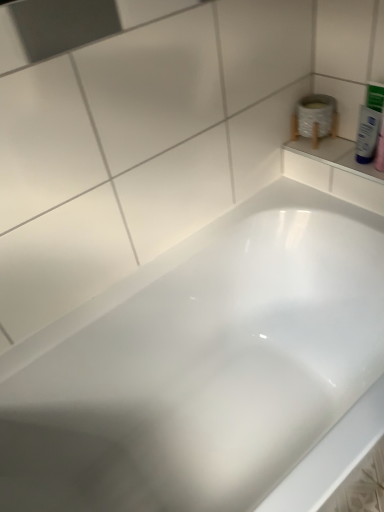
Question: Is white glossy tube at upper right facing away from white glossy bathtub at center?

Choices:
 (A) yes
 (B) no

Answer: (B)

Question: Is white glossy tube at upper right taller than white glossy bathtub at center?

Choices:
 (A) yes
 (B) no

Answer: (B)

Question: From a real-world perspective, is white glossy tube at upper right positioned under white glossy bathtub at center based on gravity?

Choices:
 (A) yes
 (B) no

Answer: (B)

Question: From a real-world perspective, is white glossy tube at upper right on top of white glossy bathtub at center?

Choices:
 (A) no
 (B) yes

Answer: (B)

Question: Can you confirm if white glossy tube at upper right is positioned to the left of white glossy bathtub at center?

Choices:
 (A) yes
 (B) no

Answer: (B)

Question: Could you tell me if white glossy tube at upper right is turned towards white glossy bathtub at center?

Choices:
 (A) yes
 (B) no

Answer: (B)

Question: Is white glossy bathtub at center at the left side of white glossy tube at upper right?

Choices:
 (A) yes
 (B) no

Answer: (A)

Question: Is white glossy bathtub at center closer to camera compared to white glossy tube at upper right?

Choices:
 (A) no
 (B) yes

Answer: (B)

Question: From a real-world perspective, is white glossy bathtub at center on top of white glossy tube at upper right?

Choices:
 (A) yes
 (B) no

Answer: (B)

Question: Is white glossy bathtub at center taller than white glossy tube at upper right?

Choices:
 (A) no
 (B) yes

Answer: (B)

Question: Could you tell me if white glossy bathtub at center is turned towards white glossy tube at upper right?

Choices:
 (A) yes
 (B) no

Answer: (B)

Question: Can you see white glossy bathtub at center touching white glossy tube at upper right?

Choices:
 (A) yes
 (B) no

Answer: (B)

Question: Is white glossy bathtub at center taller or shorter than white glossy tube at upper right?

Choices:
 (A) short
 (B) tall

Answer: (B)